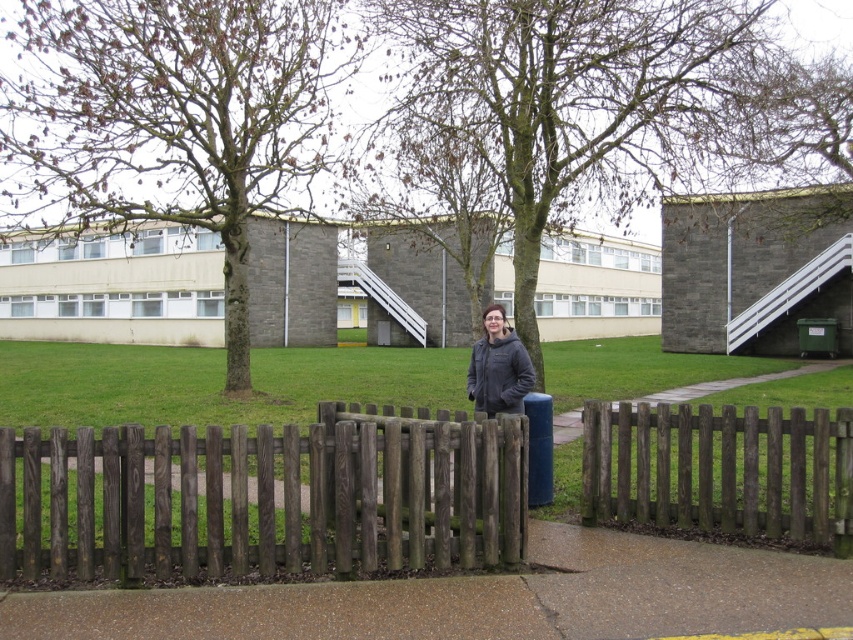
Between dark brown wooden fence at center and brown wooden fence at center, which one has less height?

Standing shorter between the two is brown wooden fence at center.

Between point (407, 464) and point (728, 465), which one is positioned in front?

Positioned in front is point (407, 464).

What do you see at coordinates (267, 499) in the screenshot?
I see `dark brown wooden fence at center` at bounding box center [267, 499].

The height and width of the screenshot is (640, 853). In order to click on dark brown wooden fence at center in this screenshot , I will do `click(267, 499)`.

Is dark brown wooden fence at center shorter than smooth concrete pavement at center?

Incorrect, dark brown wooden fence at center's height does not fall short of smooth concrete pavement at center's.

Measure the distance between dark brown wooden fence at center and smooth concrete pavement at center.

dark brown wooden fence at center and smooth concrete pavement at center are 4.54 feet apart from each other.

Does point (165, 550) come farther from viewer compared to point (543, 554)?

No, it is not.

The width and height of the screenshot is (853, 640). What are the coordinates of `dark brown wooden fence at center` in the screenshot? It's located at pos(267,499).

Between brown wooden fence at center and dark gray jacket at center, which one is positioned higher?

Positioned higher is dark gray jacket at center.

Locate an element on the screen. The width and height of the screenshot is (853, 640). brown wooden fence at center is located at coordinates (718, 470).

Between point (843, 499) and point (488, 324), which one is positioned behind?

The point (488, 324) is behind.

Find the location of a particular element. The image size is (853, 640). brown wooden fence at center is located at coordinates (718, 470).